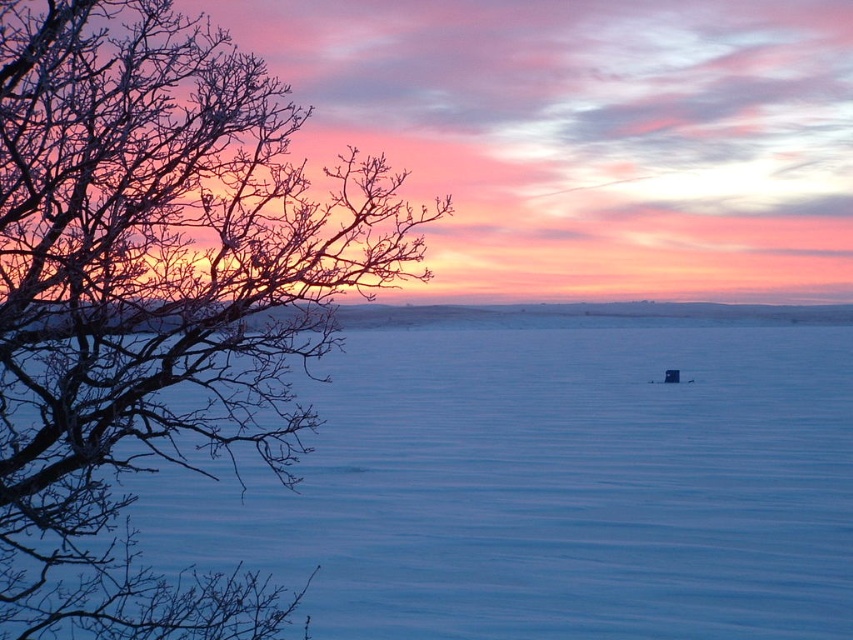
Question: Among these points, which one is farthest from the camera?

Choices:
 (A) (39, 128)
 (B) (670, 321)

Answer: (B)

Question: Does smooth ice at center have a lesser width compared to bare branches at left?

Choices:
 (A) no
 (B) yes

Answer: (A)

Question: Can you confirm if smooth ice at center is positioned below bare branches at left?

Choices:
 (A) yes
 (B) no

Answer: (A)

Question: Which object appears farthest from the camera in this image?

Choices:
 (A) smooth ice at center
 (B) bare branches at left

Answer: (A)

Question: Can you confirm if smooth ice at center is wider than bare branches at left?

Choices:
 (A) no
 (B) yes

Answer: (B)

Question: Which object is farther from the camera taking this photo?

Choices:
 (A) bare branches at left
 (B) smooth ice at center

Answer: (B)